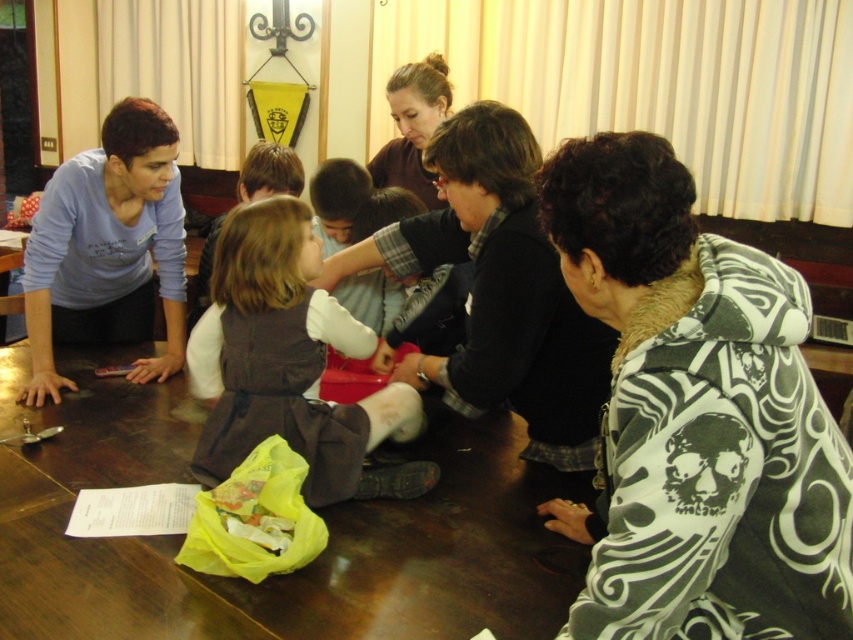
You are standing in the room and want to pick up the black sweater at center. Based on its position, where exactly should you look to find it?

The black sweater at center is located at point 0.458 along the horizontal axis and 0.586 along the vertical axis, so you should look towards the middle of the image slightly to the right and up from the bottom center.

You are standing in the room and want to place a decorative vase on the table. Which side of the dark gray fabric dress at center should you place the vase on to ensure it is on the right side of the brown polished wood table at center?

The brown polished wood table at center is positioned on the left side of dark gray fabric dress at center, so to place the vase on the right side of the table, you should place it on the right side of the dark gray fabric dress at center.

You are a delivery person who needs to place a package that is 1.2 meters long between the black sweater at center and the brown matte hair at upper center. Can you fit the package between them without overlapping?

The distance between the black sweater at center and the brown matte hair at upper center is 1.04 meters, which is shorter than the package length of 1.2 meters. Therefore, the package cannot be placed between them without overlapping.